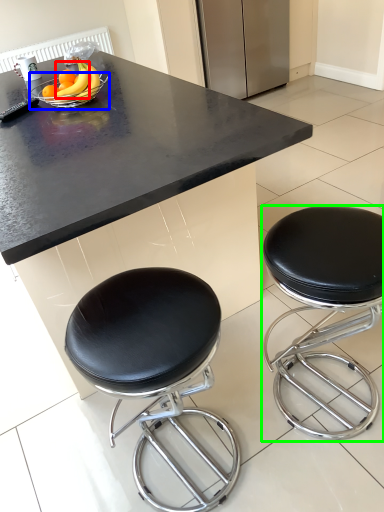
Question: Estimate the real-world distances between objects in this image. Which object is closer to banana (highlighted by a red box), bowl (highlighted by a blue box) or stool (highlighted by a green box)?

Choices:
 (A) bowl
 (B) stool

Answer: (A)